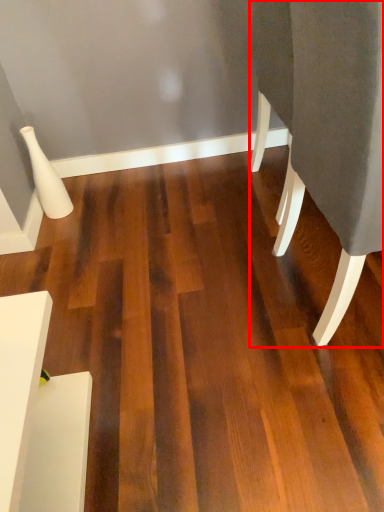
Question: From the image's perspective, what is the correct spatial positioning of furniture (annotated by the red box) in reference to furniture?

Choices:
 (A) below
 (B) above

Answer: (B)